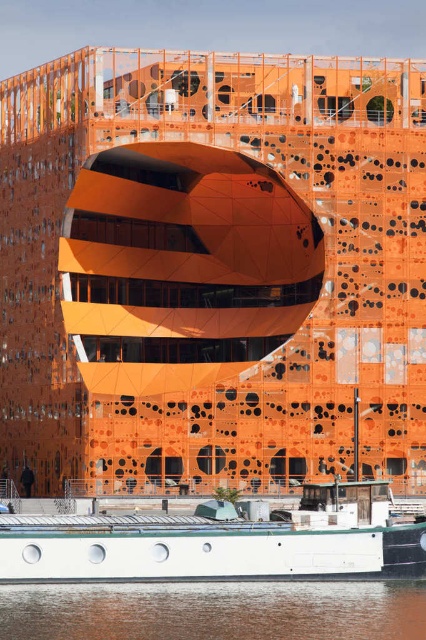
Consider the image. Is orange matte building at center shorter than brown water at lower center?

No, orange matte building at center is not shorter than brown water at lower center.

Is orange matte building at center below brown water at lower center?

No, orange matte building at center is not below brown water at lower center.

Does point (17, 259) come behind point (411, 634)?

Yes, it is behind point (411, 634).

I want to click on orange matte building at center, so click(x=212, y=269).

Who is taller, orange matte building at center or white matte boat at lower center?

orange matte building at center is taller.

The image size is (426, 640). I want to click on orange matte building at center, so click(212, 269).

Where is `orange matte building at center`? The image size is (426, 640). orange matte building at center is located at coordinates (212, 269).

Does white matte boat at lower center have a lesser width compared to brown water at lower center?

No, white matte boat at lower center is not thinner than brown water at lower center.

Is white matte boat at lower center above brown water at lower center?

Correct, white matte boat at lower center is located above brown water at lower center.

What do you see at coordinates (221, 541) in the screenshot? I see `white matte boat at lower center` at bounding box center [221, 541].

Where is `white matte boat at lower center`? white matte boat at lower center is located at coordinates (221, 541).